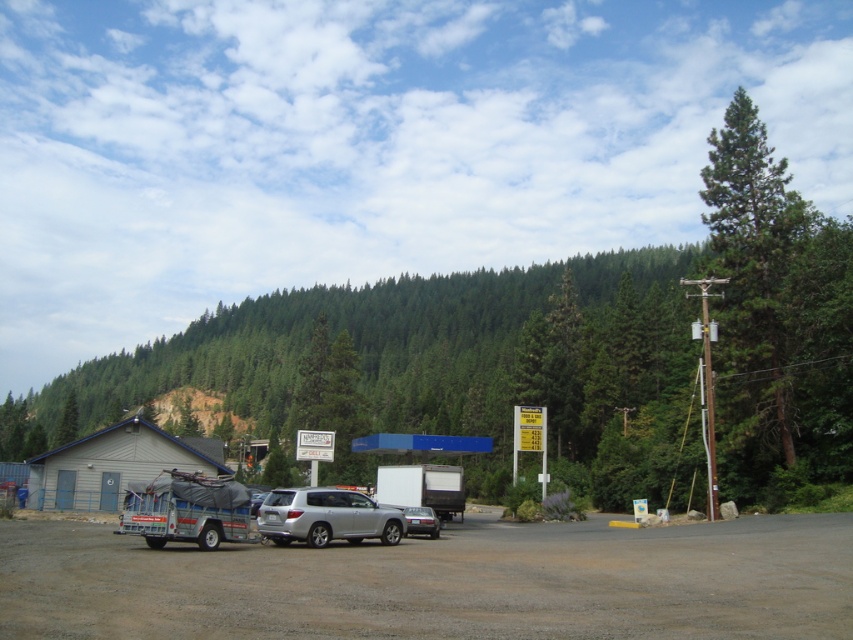
Question: Observing the image, what is the correct spatial positioning of dark gray asphalt parking lot at center in reference to silver metallic sedan at center?

Choices:
 (A) left
 (B) right

Answer: (A)

Question: Which of these objects is positioned farthest from the silver metallic sedan at center?

Choices:
 (A) green leafy tree at center
 (B) dark gray asphalt parking lot at center
 (C) metallic silver pickup truck at lower left
 (D) silver metallic suv at center

Answer: (A)

Question: Among these points, which one is farthest from the camera?

Choices:
 (A) (718, 394)
 (B) (22, 589)
 (C) (260, 516)
 (D) (229, 524)

Answer: (A)

Question: Is green leafy tree at center to the right of silver metallic suv at center from the viewer's perspective?

Choices:
 (A) yes
 (B) no

Answer: (B)

Question: Which object is closer to the camera taking this photo?

Choices:
 (A) dark gray asphalt parking lot at center
 (B) silver metallic suv at center
 (C) silver metallic sedan at center

Answer: (A)

Question: Does silver metallic suv at center appear on the left side of silver metallic sedan at center?

Choices:
 (A) yes
 (B) no

Answer: (A)